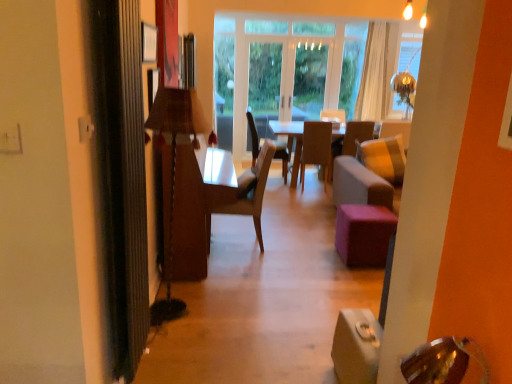
Where is `brown leather chair at center, the second chair from the back`? brown leather chair at center, the second chair from the back is located at coordinates (316, 148).

Describe the element at coordinates (253, 136) in the screenshot. I see `wooden chair at center, marked as the 1th chair in a back-to-front arrangement` at that location.

The image size is (512, 384). What are the coordinates of `light gray fabric armchair at center` in the screenshot? It's located at (352, 138).

Considering the sizes of objects white sheer curtain at upper right and purple fabric stool at center in the image provided, who is shorter, white sheer curtain at upper right or purple fabric stool at center?

Answer: With less height is purple fabric stool at center.

Is the surface of white sheer curtain at upper right in direct contact with purple fabric stool at center?

white sheer curtain at upper right and purple fabric stool at center are not in contact.

From a real-world perspective, between white sheer curtain at upper right and purple fabric stool at center, who is vertically higher?

white sheer curtain at upper right is physically above.

Based on the photo, considering their positions, is transparent glass door at center located in front of or behind wooden lamp at left?

transparent glass door at center is behind wooden lamp at left.

Considering the relative sizes of transparent glass door at center and wooden lamp at left in the image provided, is transparent glass door at center thinner than wooden lamp at left?

Indeed, transparent glass door at center has a lesser width compared to wooden lamp at left.

From the image's perspective, would you say transparent glass door at center is shown under wooden lamp at left?

Incorrect, from the image's perspective, transparent glass door at center is higher than wooden lamp at left.

Is transparent glass door at center at the right side of wooden lamp at left?

Indeed, transparent glass door at center is positioned on the right side of wooden lamp at left.

Is transparent glass door at center facing away from purple fabric stool at center?

transparent glass door at center is not turned away from purple fabric stool at center.

Would you say purple fabric stool at center is part of transparent glass door at center's contents?

That's incorrect, purple fabric stool at center is not inside transparent glass door at center.

Is transparent glass door at center closer to the viewer compared to purple fabric stool at center?

No, transparent glass door at center is further to the viewer.

Is point (258, 89) closer to viewer compared to point (368, 238)?

No, it is not.

Consider the image. Is purple fabric stool at center to the left or to the right of brown leather chair at center, which is the 2th chair from front to back, in the image?

From the image, it's evident that purple fabric stool at center is to the right of brown leather chair at center, which is the 2th chair from front to back.

Is point (356, 258) closer or farther from the camera than point (303, 178)?

Point (356, 258) is positioned closer to the camera compared to point (303, 178).

Who is smaller, purple fabric stool at center or brown leather chair at center, the second chair from the back?

purple fabric stool at center is smaller.

Relative to brown leather chair at center, the second chair from the back, is purple fabric stool at center in front or behind?

purple fabric stool at center is in front of brown leather chair at center, the second chair from the back.

Considering the sizes of objects white sheer curtain at upper right and light brown wood chair at center, acting as the 1th chair starting from the front, in the image provided, who is wider, white sheer curtain at upper right or light brown wood chair at center, acting as the 1th chair starting from the front,?

Wider between the two is light brown wood chair at center, acting as the 1th chair starting from the front.

From the image's perspective, is white sheer curtain at upper right above light brown wood chair at center, placed as the third chair when sorted from right to left?

Yes.

Does white sheer curtain at upper right have a greater height compared to light brown wood chair at center, placed as the third chair when sorted from right to left?

Indeed, white sheer curtain at upper right has a greater height compared to light brown wood chair at center, placed as the third chair when sorted from right to left.

Is white sheer curtain at upper right inside the boundaries of light brown wood chair at center, acting as the 1th chair starting from the front, or outside?

white sheer curtain at upper right lies outside light brown wood chair at center, acting as the 1th chair starting from the front.

Considering the sizes of objects wooden lamp at left and white sheer curtain at upper right in the image provided, who is taller, wooden lamp at left or white sheer curtain at upper right?

white sheer curtain at upper right.

Based on the photo, between wooden lamp at left and white sheer curtain at upper right, which one has larger width?

wooden lamp at left.

Are wooden lamp at left and white sheer curtain at upper right beside each other?

No.

Which is more to the left, wooden lamp at left or white sheer curtain at upper right?

wooden lamp at left is more to the left.

Can you tell me how much wooden lamp at left and light brown wood chair at center, acting as the 1th chair starting from the front, differ in facing direction?

The angle between the facing direction of wooden lamp at left and the facing direction of light brown wood chair at center, acting as the 1th chair starting from the front, is 175 degrees.

Considering the positions of objects wooden lamp at left and light brown wood chair at center, acting as the 1th chair starting from the front, in the image provided, who is behind, wooden lamp at left or light brown wood chair at center, acting as the 1th chair starting from the front,?

light brown wood chair at center, acting as the 1th chair starting from the front, is more distant.

Is wooden lamp at left turned away from light brown wood chair at center, placed as the third chair when sorted from right to left?

No, light brown wood chair at center, placed as the third chair when sorted from right to left, is not at the back of wooden lamp at left.

Is light brown wood chair at center, positioned as the first chair in left-to-right order, inside wooden lamp at left?

Actually, light brown wood chair at center, positioned as the first chair in left-to-right order, is outside wooden lamp at left.

Identify the location of stool below the white sheer curtain at upper right (from the image's perspective). (364, 234).

I want to click on lamp located underneath the transparent glass door at center (from a real-world perspective), so click(173, 172).

Which object lies nearer to the anchor point light brown wood chair at center, positioned as the first chair in left-to-right order, white sheer curtain at upper right or brown leather chair at center, the third chair when ordered from left to right?

Among the two, brown leather chair at center, the third chair when ordered from left to right, is located nearer to light brown wood chair at center, positioned as the first chair in left-to-right order.

When comparing their distances from wooden chair at center, arranged as the second chair when viewed from the right, does wooden lamp at left or white sheer curtain at upper right seem further?

Based on the image, wooden lamp at left appears to be further to wooden chair at center, arranged as the second chair when viewed from the right.

Which object lies nearer to the anchor point light gray fabric armchair at center, wooden lamp at left or white sheer curtain at upper right?

Based on the image, white sheer curtain at upper right appears to be nearer to light gray fabric armchair at center.

Estimate the real-world distances between objects in this image. Which object is closer to brown leather chair at center, the third chair when ordered from left to right, wooden lamp at left or purple fabric stool at center?

purple fabric stool at center.

Which object lies nearer to the anchor point brown leather chair at center, which is the 2th chair from front to back, light gray fabric armchair at center or light brown wood chair at center, the third chair viewed from the back?

light gray fabric armchair at center is closer to brown leather chair at center, which is the 2th chair from front to back.

From the image, which object appears to be nearer to purple fabric stool at center, light brown wood chair at center, placed as the third chair when sorted from right to left, or wooden chair at center, arranged as the second chair when viewed from the right?

Among the two, light brown wood chair at center, placed as the third chair when sorted from right to left, is located nearer to purple fabric stool at center.

From the image, which object appears to be nearer to wooden lamp at left, wooden chair at center, arranged as the second chair when viewed from the right, or brown leather chair at center, which is the 2th chair from front to back?

wooden chair at center, arranged as the second chair when viewed from the right, is positioned closer to the anchor wooden lamp at left.

From the image, which object appears to be nearer to wooden chair at center, positioned as the 2th chair in left-to-right order, transparent glass door at center or light brown wood chair at center, placed as the third chair when sorted from right to left?

transparent glass door at center is closer to wooden chair at center, positioned as the 2th chair in left-to-right order.

At what (x,y) coordinates should I click in order to perform the action: click on armchair located between brown leather chair at center, the third chair when ordered from left to right, and transparent glass door at center in the depth direction. Please return your answer as a coordinate pair (x, y). This screenshot has height=384, width=512. Looking at the image, I should click on (352, 138).

The height and width of the screenshot is (384, 512). In order to click on chair between wooden chair at center, arranged as the second chair when viewed from the right, and light gray fabric armchair at center from left to right in this screenshot , I will do `click(316, 148)`.

This screenshot has height=384, width=512. Find the location of `armchair located between wooden lamp at left and transparent glass door at center in the depth direction`. armchair located between wooden lamp at left and transparent glass door at center in the depth direction is located at coordinates pyautogui.click(x=352, y=138).

Where is `stool between wooden lamp at left and wooden chair at center, which is counted as the third chair, starting from the front, from front to back`? Image resolution: width=512 pixels, height=384 pixels. stool between wooden lamp at left and wooden chair at center, which is counted as the third chair, starting from the front, from front to back is located at coordinates (364, 234).